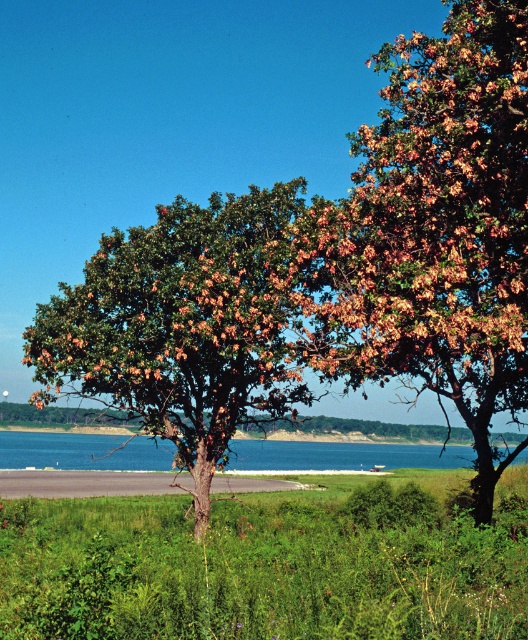
Based on the photo, does green leafy tree at center have a lesser height compared to gray asphalt at lower center?

No.

Looking at this image, is green leafy tree at center bigger than gray asphalt at lower center?

No, green leafy tree at center is not bigger than gray asphalt at lower center.

Is point (187, 387) farther from viewer compared to point (143, 490)?

No, it is in front of (143, 490).

Image resolution: width=528 pixels, height=640 pixels. I want to click on green leafy tree at center, so click(183, 324).

Looking at this image, who is taller, orange-brown textured tree at right or blue liquid water at center?

With more height is orange-brown textured tree at right.

Which is below, orange-brown textured tree at right or blue liquid water at center?

blue liquid water at center is below.

The image size is (528, 640). What do you see at coordinates (433, 230) in the screenshot?
I see `orange-brown textured tree at right` at bounding box center [433, 230].

You are a GUI agent. You are given a task and a screenshot of the screen. Output one action in this format:
    pyautogui.click(x=<x>, y=<y>)
    Task: Click on the orange-brown textured tree at right
    
    Given the screenshot: What is the action you would take?
    (433, 230)

Is green leafy tree at center below blue liquid water at center?

Incorrect, green leafy tree at center is not positioned below blue liquid water at center.

Looking at this image, does green leafy tree at center have a larger size compared to blue liquid water at center?

No, green leafy tree at center is not bigger than blue liquid water at center.

At what (x,y) coordinates should I click in order to perform the action: click on green leafy tree at center. Please return your answer as a coordinate pair (x, y). The image size is (528, 640). Looking at the image, I should click on (183, 324).